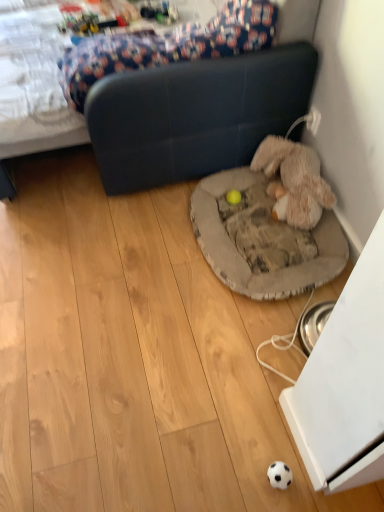
This screenshot has height=512, width=384. Find the location of `vacant region to the left of yellow rubber ball at center, which ranks as the 1th toy in left-to-right order`. vacant region to the left of yellow rubber ball at center, which ranks as the 1th toy in left-to-right order is located at coordinates (183, 201).